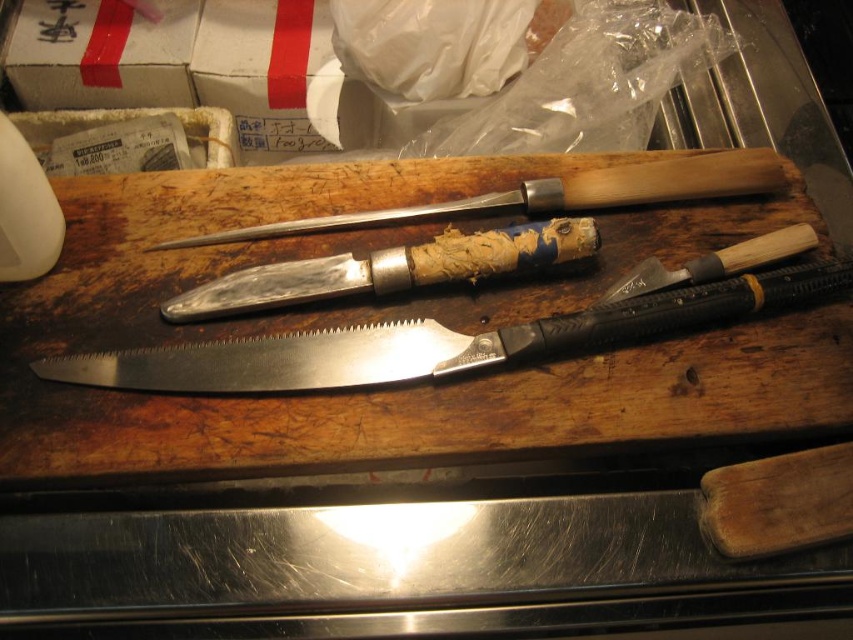
Question: Estimate the real-world distances between objects in this image. Which object is farther from the polished silver knife at center?

Choices:
 (A) wooden cutting board at center
 (B) white cardboard box at upper left

Answer: (B)

Question: Is metallic saw at center further to the viewer compared to white cardboard box at upper left?

Choices:
 (A) no
 (B) yes

Answer: (A)

Question: Among these objects, which one is nearest to the camera?

Choices:
 (A) wooden cutting board at center
 (B) white cardboard box at upper left
 (C) silver metallic knife at center

Answer: (A)

Question: Does wooden cutting board at center lie in front of silver metallic knife at center?

Choices:
 (A) yes
 (B) no

Answer: (A)

Question: Which point is closer to the camera?

Choices:
 (A) polished metal steak knife at center
 (B) metallic saw at center
 (C) wooden cutting board at center
 (D) white cardboard box at upper left

Answer: (C)

Question: Does polished metal steak knife at center appear on the right side of wooden-handled chisel at center?

Choices:
 (A) yes
 (B) no

Answer: (B)